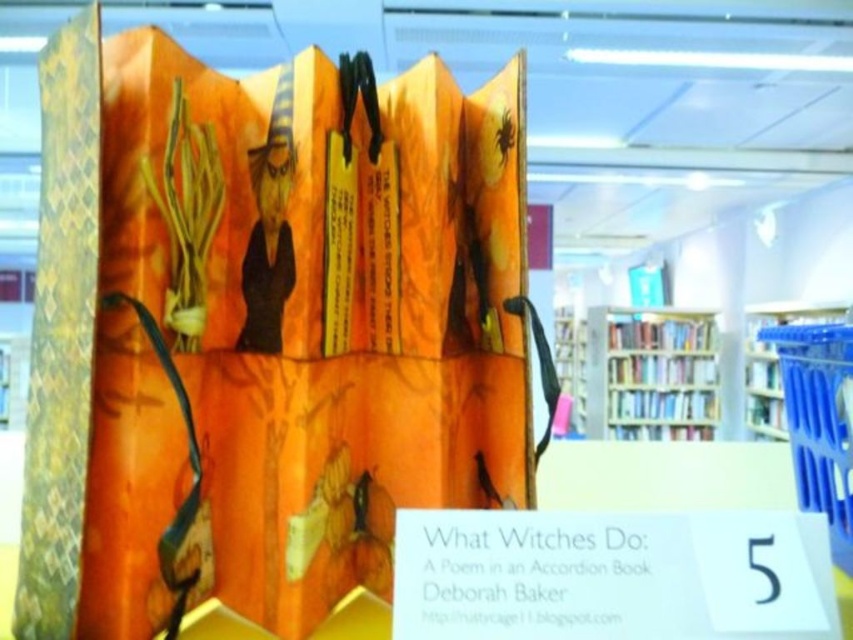
Is yellow woven fabric at left closer to the viewer compared to blue plastic bookshelf at right?

Yes, yellow woven fabric at left is closer to the viewer.

Who is shorter, yellow woven fabric at left or blue plastic bookshelf at right?

yellow woven fabric at left

Is point (45, 204) closer to viewer compared to point (779, 426)?

That is True.

Identify the location of yellow woven fabric at left. The height and width of the screenshot is (640, 853). (61, 332).

Is wooden bookshelf at center thinner than blue plastic bookshelf at right?

Incorrect, wooden bookshelf at center's width is not less than blue plastic bookshelf at right's.

Who is more forward, (671, 396) or (776, 422)?

Point (776, 422)

You are a GUI agent. You are given a task and a screenshot of the screen. Output one action in this format:
    pyautogui.click(x=<x>, y=<y>)
    Task: Click on the wooden bookshelf at center
    The width and height of the screenshot is (853, 640).
    Given the screenshot: What is the action you would take?
    pyautogui.click(x=648, y=372)

Does yellow woven fabric at left lie in front of wooden bookshelf at center?

Yes, it is in front of wooden bookshelf at center.

Is yellow woven fabric at left further to the viewer compared to wooden bookshelf at center?

That is False.

Between point (35, 362) and point (624, 413), which one is positioned behind?

Point (624, 413)

Locate an element on the screen. This screenshot has width=853, height=640. yellow woven fabric at left is located at coordinates (61, 332).